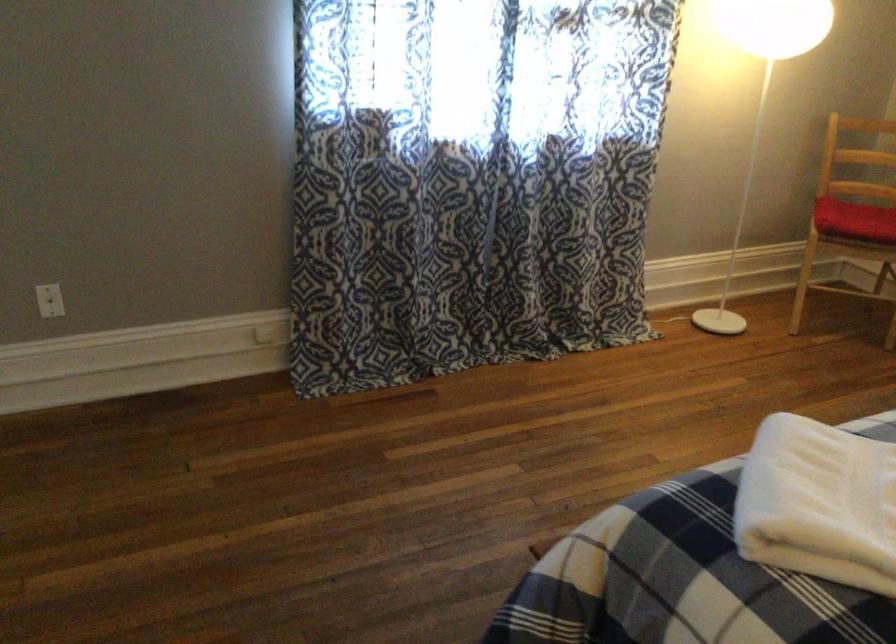
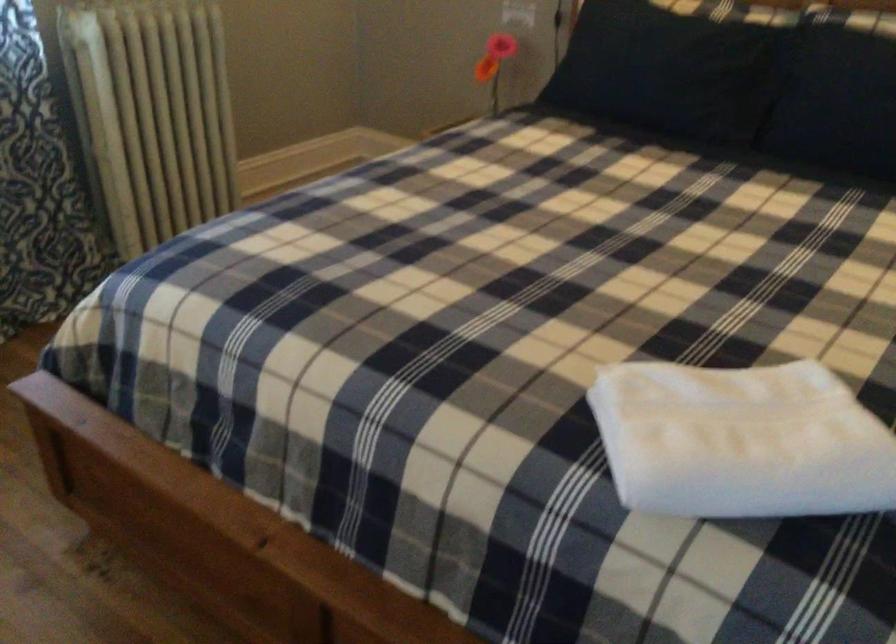
In the second image, find the point that corresponds to the point at 788,480 in the first image.

(741, 440)